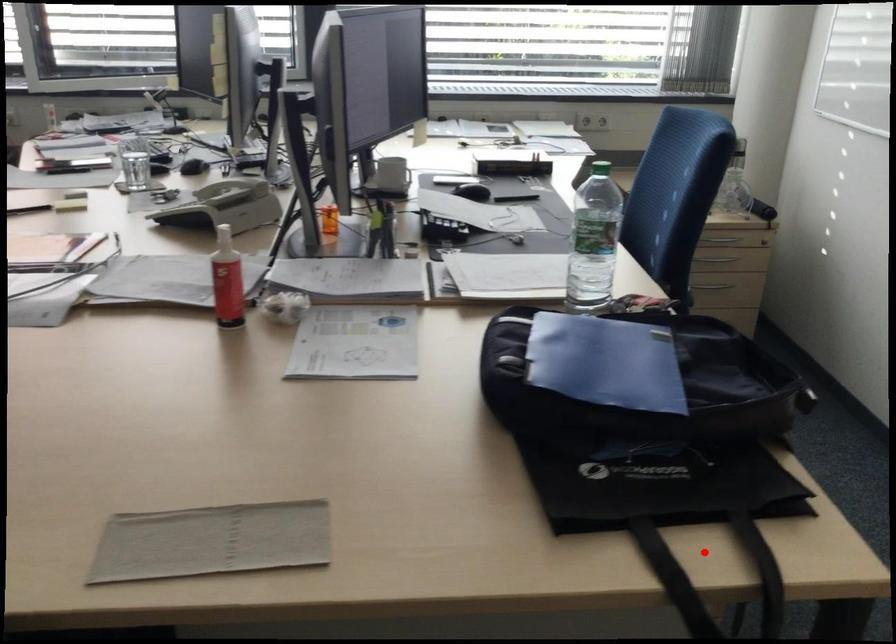
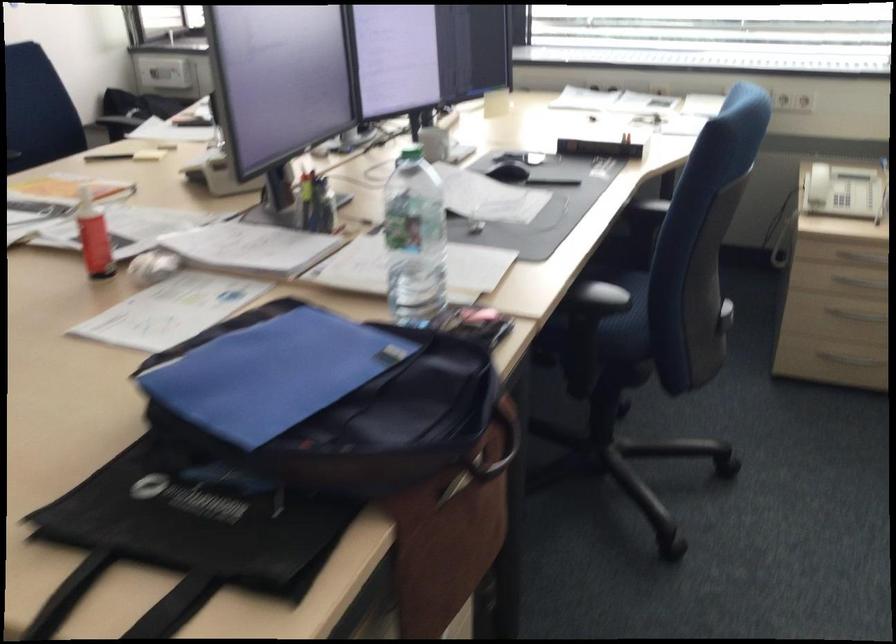
Locate, in the second image, the point that corresponds to the highlighted location in the first image.

(124, 601)